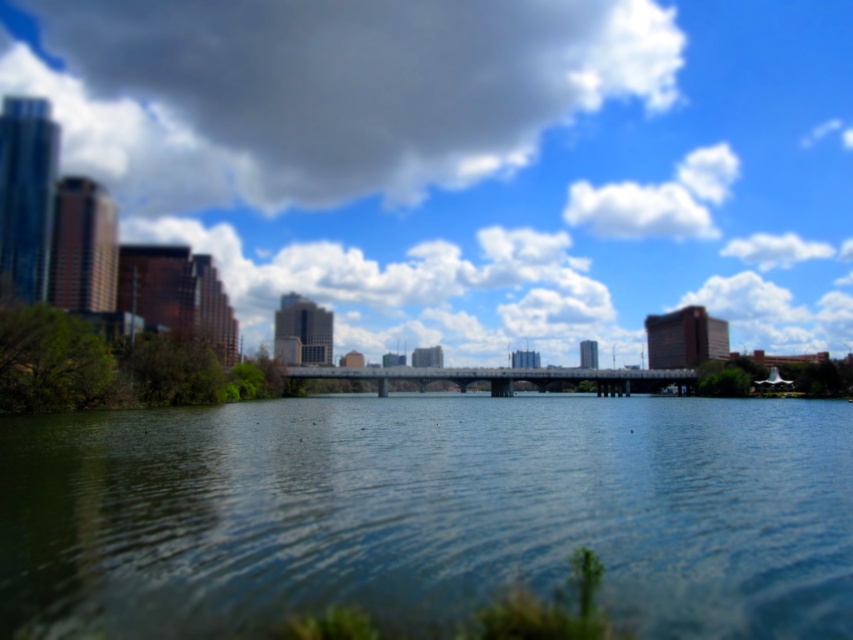
Question: Is blue water at center positioned before white fluffy cloud at upper center?

Choices:
 (A) no
 (B) yes

Answer: (B)

Question: Which is farther from the blue water at center?

Choices:
 (A) blue sky at upper center
 (B) white fluffy cloud at upper center

Answer: (B)

Question: Among these objects, which one is nearest to the camera?

Choices:
 (A) blue water at center
 (B) white fluffy cloud at upper center
 (C) dark gray cloud at upper center

Answer: (A)

Question: Which object is positioned farthest from the white fluffy cloud at upper center?

Choices:
 (A) dark gray cloud at upper center
 (B) blue sky at upper center
 (C) blue water at center

Answer: (C)

Question: Can you confirm if blue water at center is smaller than dark gray cloud at upper center?

Choices:
 (A) no
 (B) yes

Answer: (B)

Question: Does blue sky at upper center appear over white fluffy cloud at upper center?

Choices:
 (A) no
 (B) yes

Answer: (B)